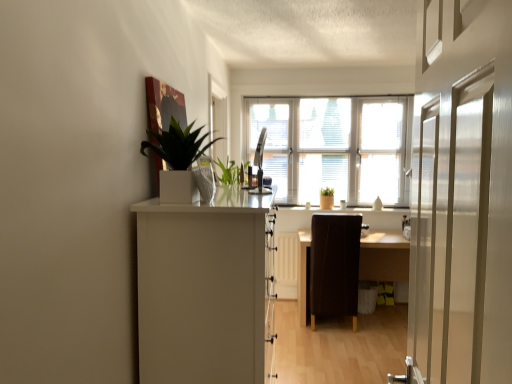
Identify the location of free space in front of brown leather chair at center. This screenshot has height=384, width=512. (345, 344).